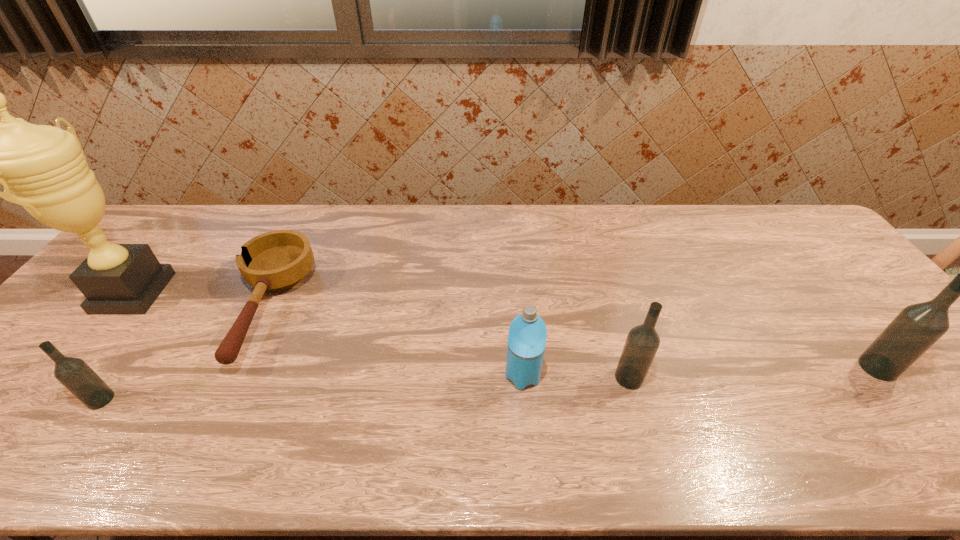
I want to click on the fourth object from left to right, so tap(527, 334).

Find the location of a particular element. The image size is (960, 540). vacant space situated on the right of the fifth tallest object is located at coordinates (278, 400).

Locate an element on the screen. The height and width of the screenshot is (540, 960). free region located on the left of the second vodka from left to right is located at coordinates (586, 378).

At what (x,y) coordinates should I click in order to perform the action: click on vacant space located on the left of the rightmost object. Please return your answer as a coordinate pair (x, y). Looking at the image, I should click on (767, 368).

Find the location of a particular element. vacant space positioned 0.320m at the front of the trophy cup with handles is located at coordinates (276, 293).

You are a GUI agent. You are given a task and a screenshot of the screen. Output one action in this format:
    pyautogui.click(x=<x>, y=<y>)
    Task: Click on the free spot located on the back of the thermos bottle
    The height and width of the screenshot is (540, 960).
    Given the screenshot: What is the action you would take?
    pyautogui.click(x=516, y=293)

Identify the location of thermos bottle at the near edge. (527, 334).

The height and width of the screenshot is (540, 960). Find the location of `object present at the left edge`. object present at the left edge is located at coordinates (44, 167).

Locate an element on the screen. The image size is (960, 540). object that is at the right edge is located at coordinates (917, 327).

The height and width of the screenshot is (540, 960). In the image, there is a desktop. What are the coordinates of `vacant space at the far edge` in the screenshot? It's located at (418, 208).